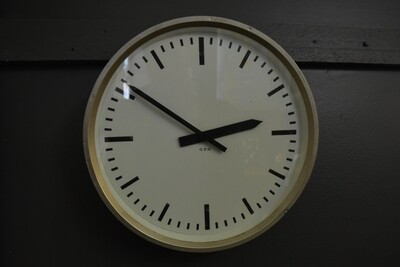
Identify the location of clock. (200, 161).